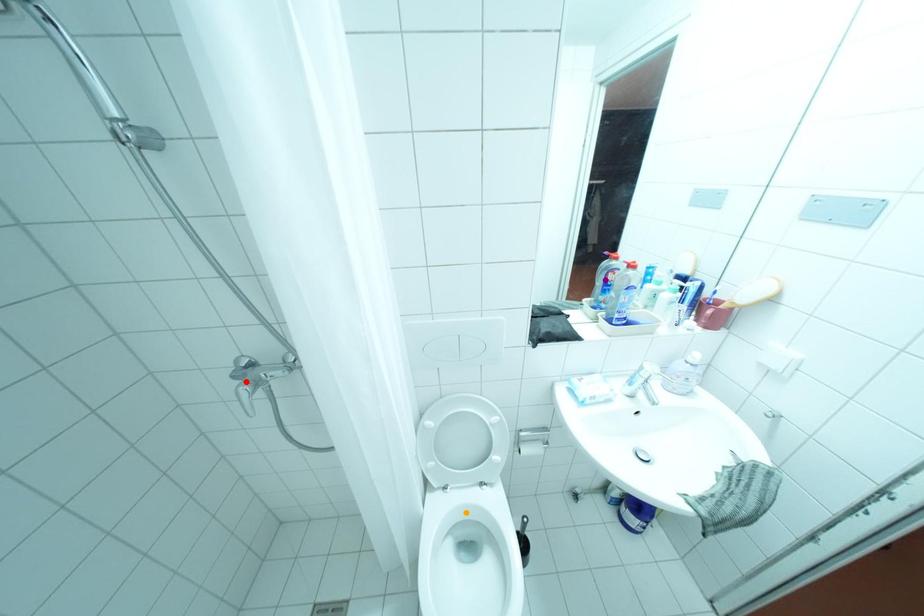
Order these from nearest to farthest:
1. orange point
2. purple point
3. red point

purple point → orange point → red point